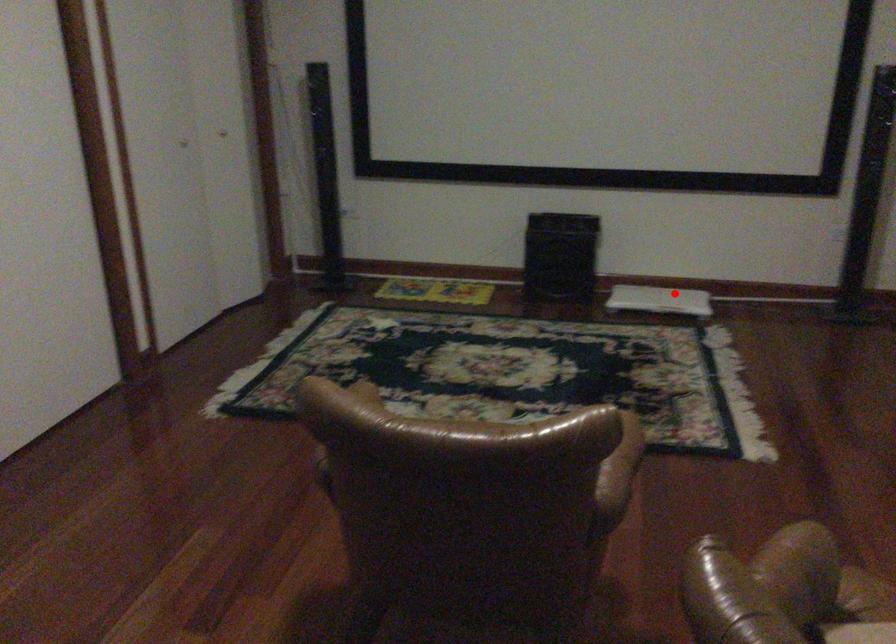
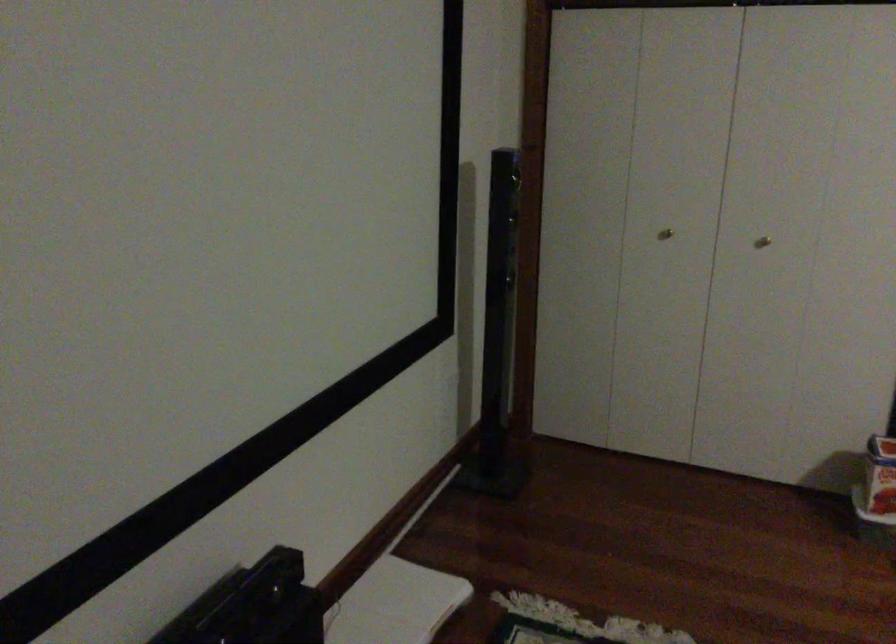
Question: A red point is marked in image1. In image2, is the corresponding 3D point closer to the camera or farther? Reply with the corresponding letter.

Choices:
 (A) The corresponding 3D point is closer.
 (B) The corresponding 3D point is farther.

Answer: (A)